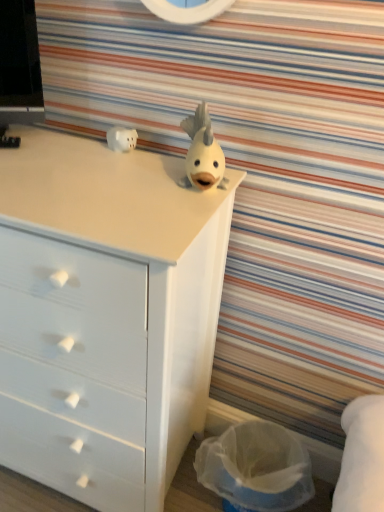
Locate an element on the screen. The image size is (384, 512). vacant space positioned to the left of white matte fish at center, the second toy positioned from the back is located at coordinates (132, 174).